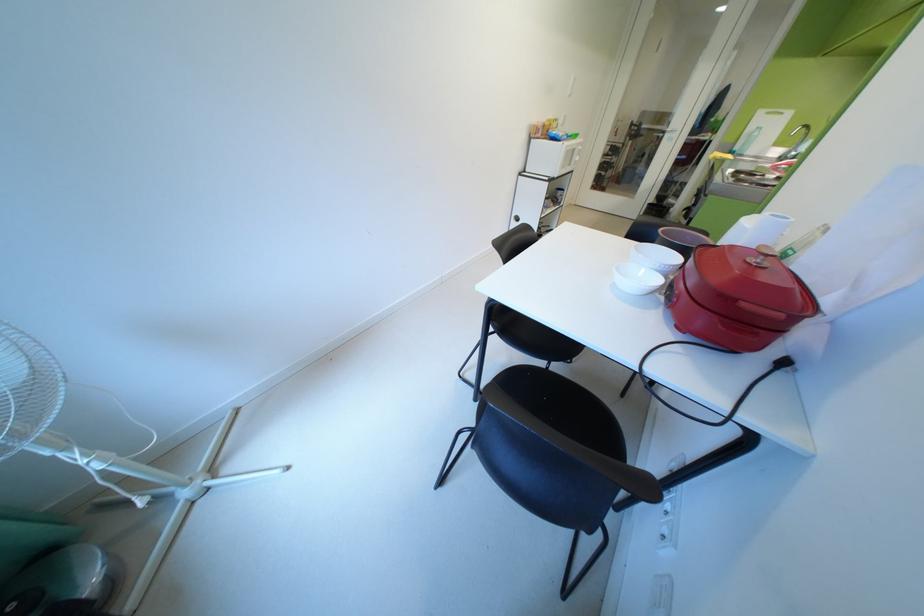
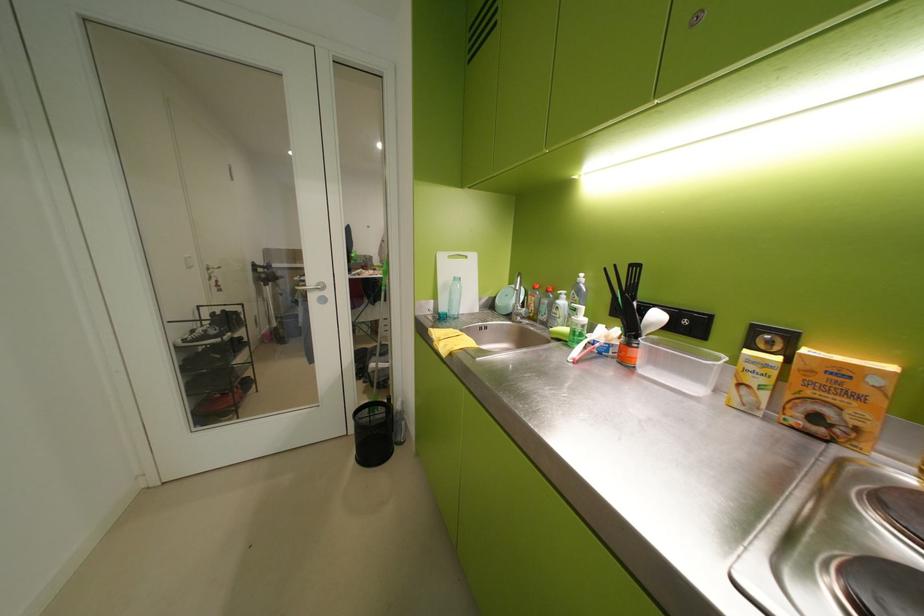
Where in the second image is the point corresponding to point 747,148 from the first image?

(453, 310)